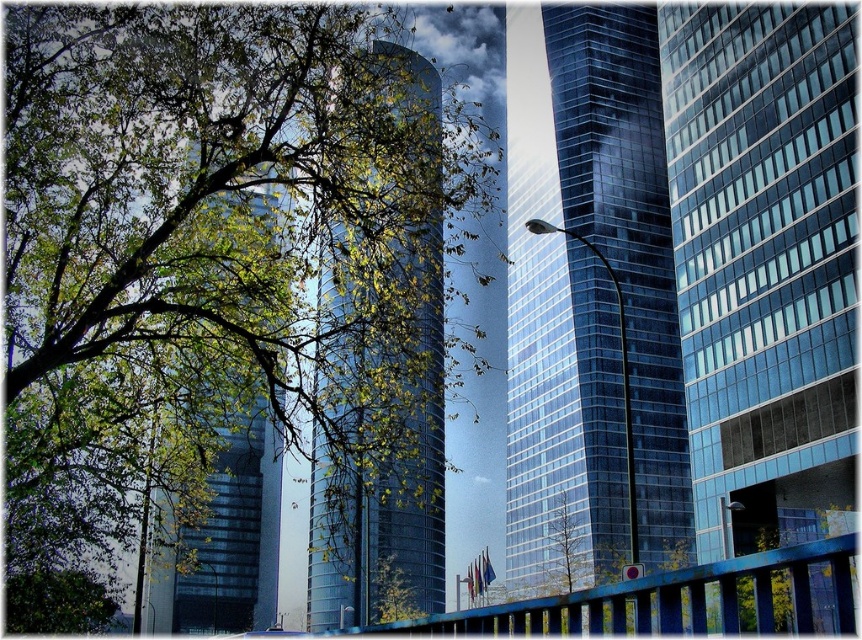
Is transparent glass skyscraper at center smaller than green leafy tree at upper left?

Yes, transparent glass skyscraper at center is smaller than green leafy tree at upper left.

Looking at this image, does transparent glass skyscraper at center appear on the right side of green leafy tree at upper left?

Correct, you'll find transparent glass skyscraper at center to the right of green leafy tree at upper left.

Who is more distant from viewer, (779, 486) or (497, 22)?

Positioned behind is point (497, 22).

This screenshot has width=862, height=640. Find the location of `transparent glass skyscraper at center`. transparent glass skyscraper at center is located at coordinates (764, 264).

In the scene shown: Which is more to the right, shiny glass skyscraper at center or glossy glass tower at center?

shiny glass skyscraper at center is more to the right.

Which is below, shiny glass skyscraper at center or glossy glass tower at center?

Positioned lower is glossy glass tower at center.

Measure the distance between point (592, 12) and camera.

They are 192.60 meters apart.

You are a GUI agent. You are given a task and a screenshot of the screen. Output one action in this format:
    pyautogui.click(x=<x>, y=<y>)
    Task: Click on the shiny glass skyscraper at center
    This screenshot has width=862, height=640.
    Given the screenshot: What is the action you would take?
    pyautogui.click(x=589, y=301)

Can you confirm if transparent glass skyscraper at center is positioned to the right of shiny glass skyscraper at center?

Yes, transparent glass skyscraper at center is to the right of shiny glass skyscraper at center.

Who is lower down, transparent glass skyscraper at center or shiny glass skyscraper at center?

transparent glass skyscraper at center is lower down.

Who is more forward, (785, 240) or (557, 554)?

Point (785, 240) is in front.

Image resolution: width=862 pixels, height=640 pixels. I want to click on transparent glass skyscraper at center, so click(x=764, y=264).